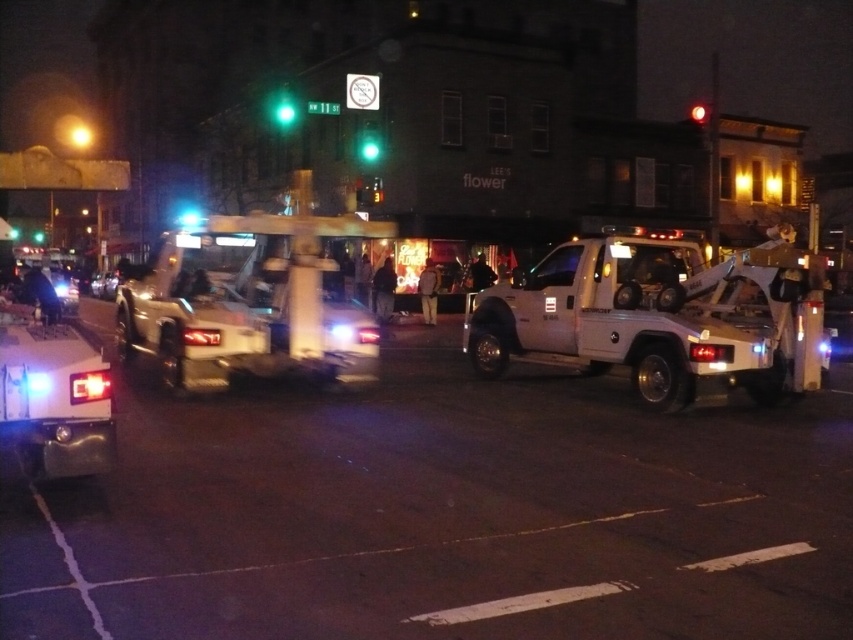
Can you confirm if metallic silver car at center is smaller than green glass traffic light at upper center?

Actually, metallic silver car at center might be larger than green glass traffic light at upper center.

This screenshot has width=853, height=640. Find the location of `metallic silver car at center`. metallic silver car at center is located at coordinates (103, 284).

Which is more to the right, green glass traffic light at center or green glass traffic light at upper center?

green glass traffic light at center

Is green glass traffic light at center shorter than green glass traffic light at upper center?

Yes.

Where is `green glass traffic light at center`? This screenshot has width=853, height=640. green glass traffic light at center is located at coordinates (369, 140).

Who is shorter, white matte tow truck at center or green glass traffic light at upper center?

green glass traffic light at upper center

Is white matte tow truck at center smaller than green glass traffic light at upper center?

Incorrect, white matte tow truck at center is not smaller in size than green glass traffic light at upper center.

Is point (250, 346) closer to viewer compared to point (281, 96)?

Yes, it is.

This screenshot has height=640, width=853. Find the location of `white matte tow truck at center`. white matte tow truck at center is located at coordinates (248, 301).